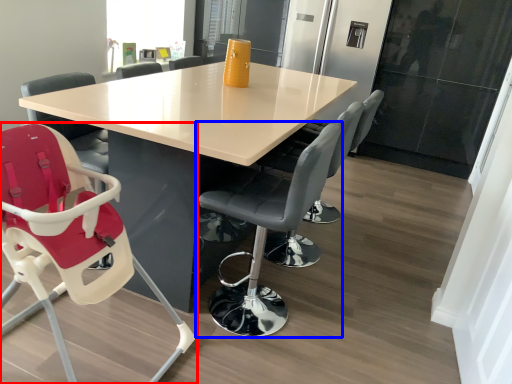
Question: Which point is closer to the camera, chair (highlighted by a red box) or chair (highlighted by a blue box)?

Choices:
 (A) chair
 (B) chair

Answer: (A)